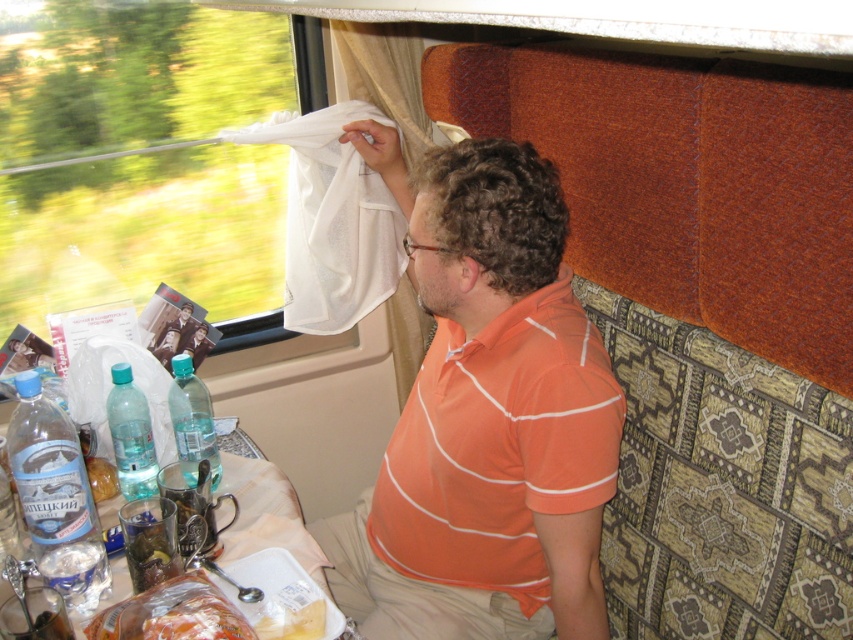
How distant is orange striped shirt at upper right from clear plastic bottle at lower left?

A distance of 20.09 inches exists between orange striped shirt at upper right and clear plastic bottle at lower left.

Which is in front, point (531, 538) or point (108, 426)?

Positioned in front is point (531, 538).

Where is `orange striped shirt at upper right`? orange striped shirt at upper right is located at coordinates (488, 424).

Can you confirm if clear plastic bottle at lower left is positioned above transparent plastic bottle at table left?

Correct, clear plastic bottle at lower left is located above transparent plastic bottle at table left.

Does clear plastic bottle at lower left come in front of transparent plastic bottle at table left?

No, clear plastic bottle at lower left is behind transparent plastic bottle at table left.

Does point (131, 378) lie behind point (204, 406)?

No, (131, 378) is in front of (204, 406).

At what (x,y) coordinates should I click in order to perform the action: click on clear plastic bottle at lower left. Please return your answer as a coordinate pair (x, y). Looking at the image, I should click on (131, 435).

Is white sheer cloth at upper left wider than clear plastic bottle at lower left?

Indeed, white sheer cloth at upper left has a greater width compared to clear plastic bottle at lower left.

Between point (337, 234) and point (129, 484), which one is positioned in front?

Point (129, 484)

Locate an element on the screen. The height and width of the screenshot is (640, 853). white sheer cloth at upper left is located at coordinates (332, 220).